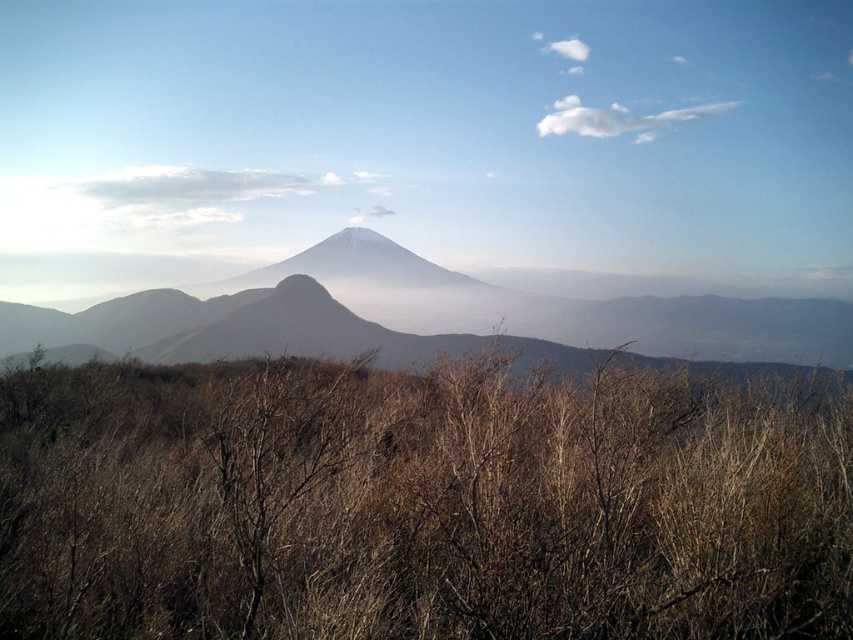
You are a hiker standing at the base of Mount Fuji and see the brown dry bush at center. If you want to take a photo of the mountain with the bush in the foreground, where should you position yourself relative to the bush?

The brown dry bush at center is located at point (421, 502), so you should position yourself in front of the brown dry bush at center to have it in the foreground of your photo.